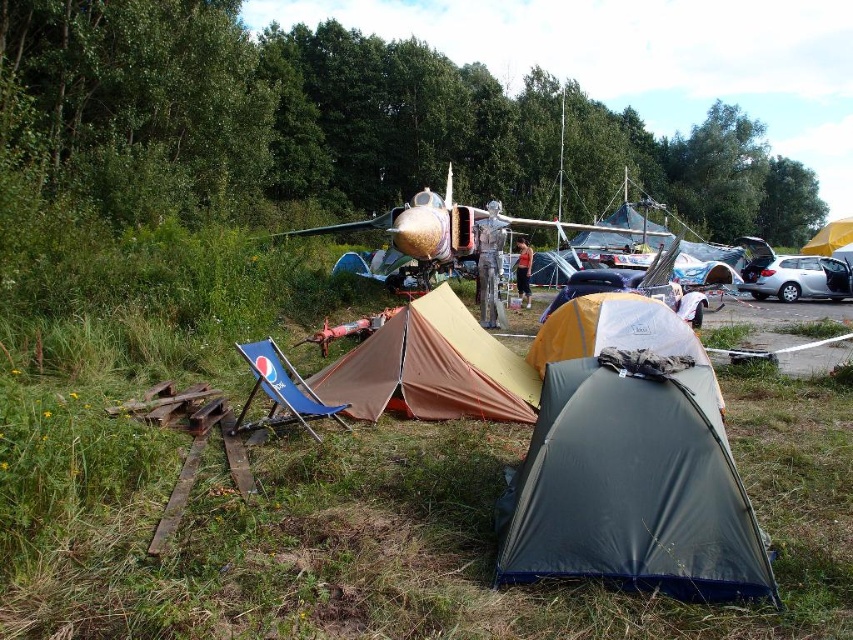
Question: Estimate the real-world distances between objects in this image. Which object is closer to the green grass at lower left?

Choices:
 (A) yellow fabric tent at center
 (B) dark gray tarp at center
 (C) silver metallic car at right
 (D) brown canvas tent at center

Answer: (B)

Question: Among these objects, which one is farthest from the camera?

Choices:
 (A) shiny metallic airplane at center
 (B) blue fabric chair at lower center
 (C) brown canvas tent at center

Answer: (A)

Question: Is green grass at lower left smaller than yellow fabric tent at center?

Choices:
 (A) no
 (B) yes

Answer: (B)

Question: Estimate the real-world distances between objects in this image. Which object is closer to the brown canvas tent at center?

Choices:
 (A) dark gray tarp at center
 (B) shiny metallic airplane at center

Answer: (A)

Question: Considering the relative positions of brown canvas tent at center and yellow fabric tent at center in the image provided, where is brown canvas tent at center located with respect to yellow fabric tent at center?

Choices:
 (A) below
 (B) above

Answer: (A)

Question: Is green grass at lower left bigger than blue fabric chair at lower center?

Choices:
 (A) yes
 (B) no

Answer: (A)